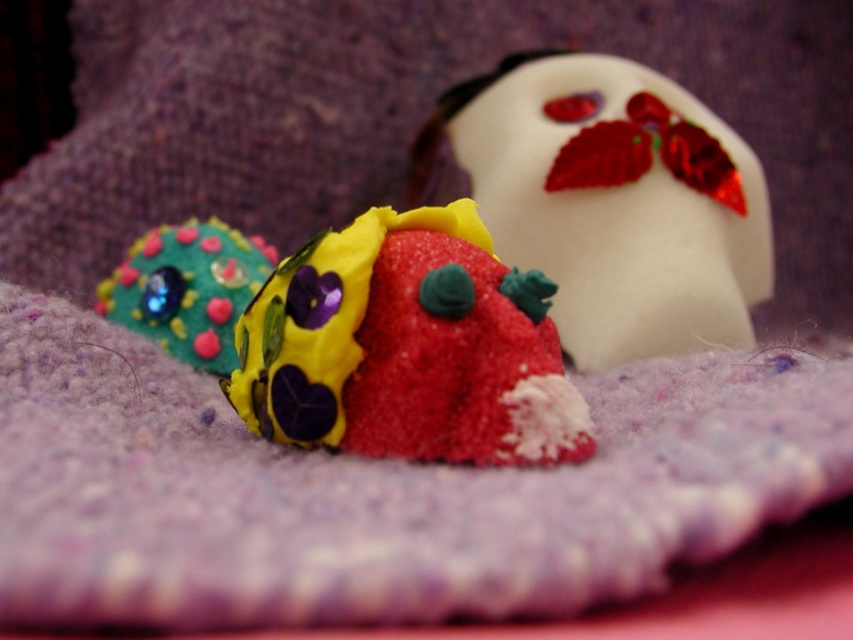
Between white glossy ghost at upper right and sandy clay strawberry at center, which one has more height?

With more height is white glossy ghost at upper right.

Is white glossy ghost at upper right above sandy clay strawberry at center?

Indeed, white glossy ghost at upper right is positioned over sandy clay strawberry at center.

Does point (526, 115) lie behind point (236, 396)?

Yes, it is behind point (236, 396).

Locate an element on the screen. Image resolution: width=853 pixels, height=640 pixels. white glossy ghost at upper right is located at coordinates (607, 200).

Who is taller, sandy clay strawberry at center or matte green fabric flower at left?

matte green fabric flower at left is taller.

Is point (318, 385) closer to camera compared to point (224, 269)?

Yes, it is.

I want to click on sandy clay strawberry at center, so click(408, 348).

Can you confirm if white glossy ghost at upper right is shorter than matte green fabric flower at left?

Incorrect, white glossy ghost at upper right's height does not fall short of matte green fabric flower at left's.

Based on the photo, does white glossy ghost at upper right have a greater width compared to matte green fabric flower at left?

Correct, the width of white glossy ghost at upper right exceeds that of matte green fabric flower at left.

Who is more distant from viewer, (685, 284) or (142, 250)?

The point (685, 284) is behind.

You are a GUI agent. You are given a task and a screenshot of the screen. Output one action in this format:
    pyautogui.click(x=<x>, y=<y>)
    Task: Click on the white glossy ghost at upper right
    
    Given the screenshot: What is the action you would take?
    pyautogui.click(x=607, y=200)